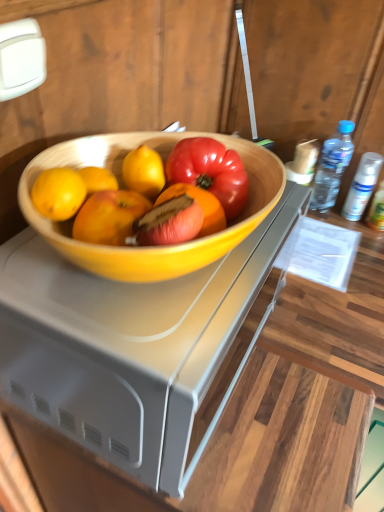
Where is `free space in front of transparent plastic bottle at right, the 1th bottle when ordered from left to right`? The height and width of the screenshot is (512, 384). free space in front of transparent plastic bottle at right, the 1th bottle when ordered from left to right is located at coordinates (348, 251).